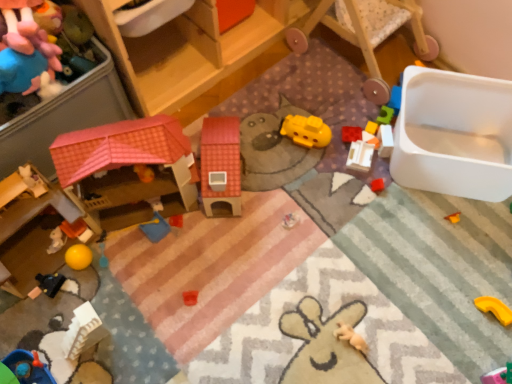
Where is `vacant space that's between light brown plush toy at lower right, which appears as the 6th toy when viewed from the left, and white plastic building at center-right, positioned as the 4th toy in right-to-left order`? vacant space that's between light brown plush toy at lower right, which appears as the 6th toy when viewed from the left, and white plastic building at center-right, positioned as the 4th toy in right-to-left order is located at coordinates (354, 246).